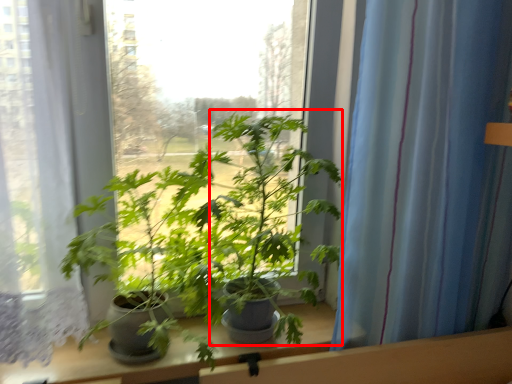
Question: From the image, what is the correct spatial relationship of parsley (annotated by the red box) in relation to curtain?

Choices:
 (A) left
 (B) right

Answer: (A)